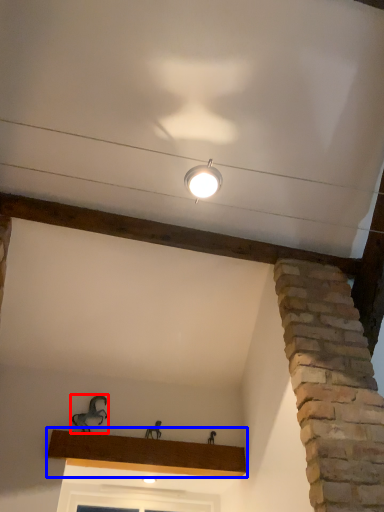
Question: Among these objects, which one is farthest to the camera, animal (highlighted by a red box) or window sill (highlighted by a blue box)?

Choices:
 (A) animal
 (B) window sill

Answer: (A)